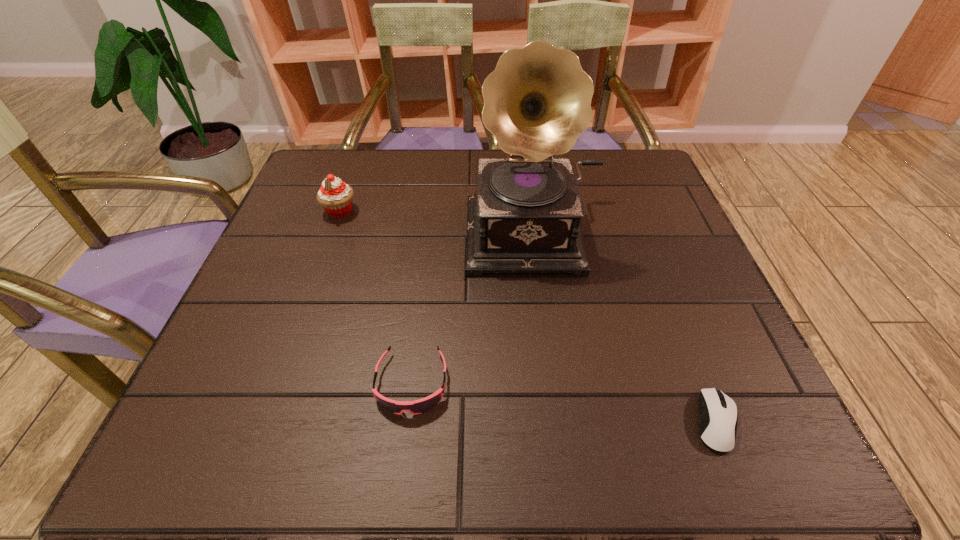
Locate an element on the screen. The width and height of the screenshot is (960, 540). object located at the far edge is located at coordinates (524, 217).

Identify the location of goggles that is at the near edge. (420, 406).

I want to click on mouse that is at the near edge, so click(x=717, y=426).

Locate an element on the screen. This screenshot has height=540, width=960. object that is at the left edge is located at coordinates (335, 196).

At what (x,y) coordinates should I click in order to perform the action: click on object present at the right edge. Please return your answer as a coordinate pair (x, y). Looking at the image, I should click on (717, 426).

I want to click on object situated at the near right corner, so [x=717, y=426].

Image resolution: width=960 pixels, height=540 pixels. I want to click on free space at the near edge, so click(643, 449).

Find the location of a particular element. The width and height of the screenshot is (960, 540). vacant space at the left edge of the desktop is located at coordinates (285, 360).

Find the location of a particular element. This screenshot has width=960, height=540. free space at the right edge of the desktop is located at coordinates (683, 305).

The height and width of the screenshot is (540, 960). I want to click on vacant space at the far left corner, so [x=368, y=153].